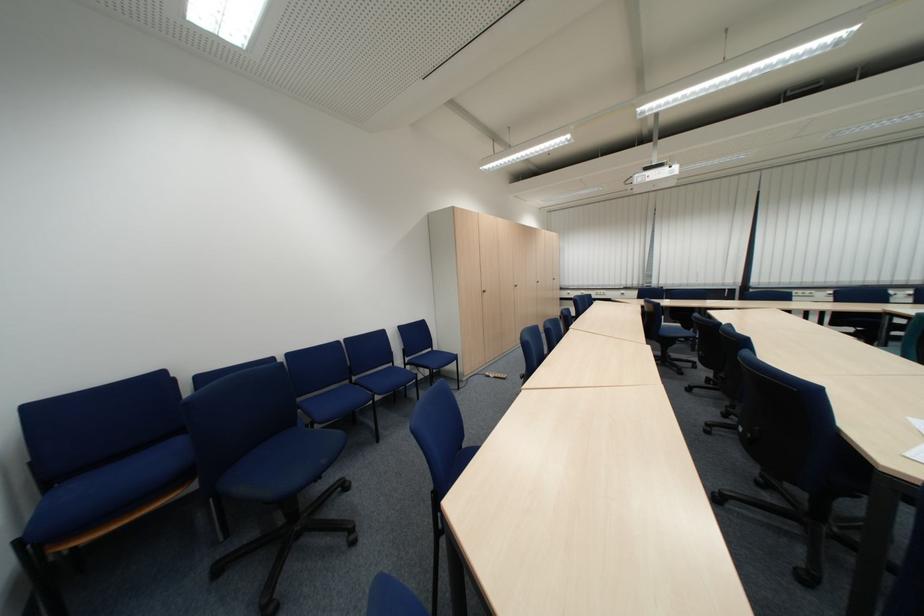
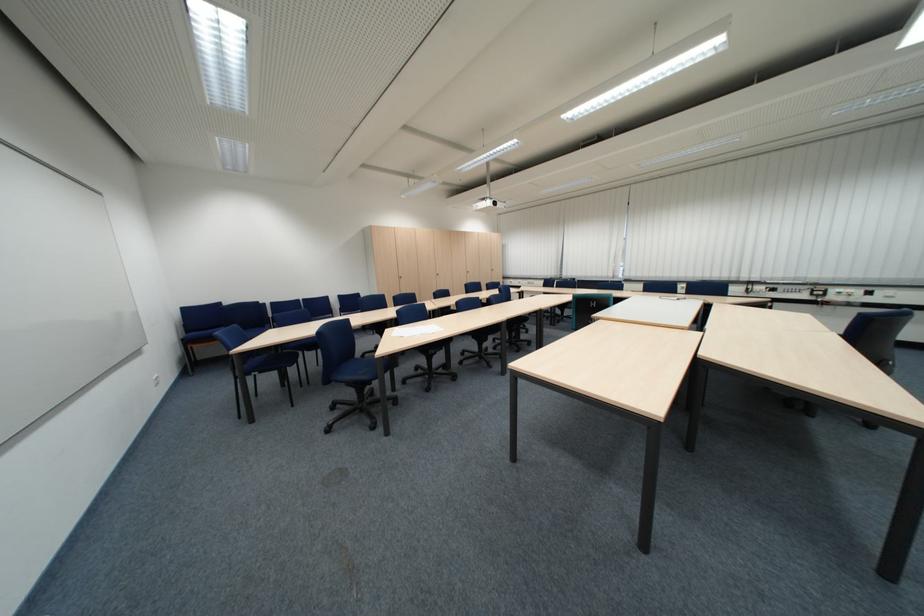
The images are taken continuously from a first-person perspective. In which direction are you moving?

The cameraman moved toward right, backward.